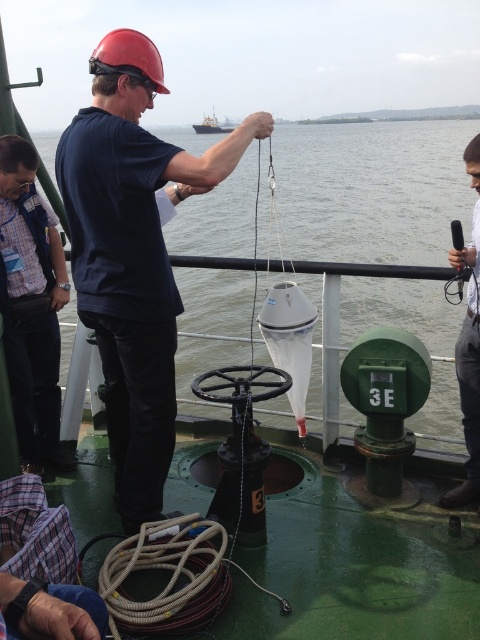
Who is lower down, matte black shirt at center or gray fabric shirt at right?

matte black shirt at center is below.

Can you confirm if matte black shirt at center is shorter than gray fabric shirt at right?

No.

Describe the element at coordinates (132, 253) in the screenshot. I see `matte black shirt at center` at that location.

The width and height of the screenshot is (480, 640). In order to click on matte black shirt at center in this screenshot , I will do `click(132, 253)`.

Is matte black shirt at center shorter than white plastic boat at upper center?

No.

Who is lower down, matte black shirt at center or white plastic boat at upper center?

matte black shirt at center

Measure the distance between point (195, 186) and camera.

Point (195, 186) and camera are 9.44 feet apart.

You are a GUI agent. You are given a task and a screenshot of the screen. Output one action in this format:
    pyautogui.click(x=<x>, y=<y>)
    Task: Click on the matte black shirt at center
    This screenshot has width=480, height=640.
    Given the screenshot: What is the action you would take?
    pyautogui.click(x=132, y=253)

Which is above, brushed metal shirt at left or gray fabric shirt at right?

gray fabric shirt at right is above.

Describe the element at coordinates (31, 307) in the screenshot. I see `brushed metal shirt at left` at that location.

Who is more distant from viewer, (49,451) or (474,269)?

The point (49,451) is more distant.

Where is `brushed metal shirt at left`? The width and height of the screenshot is (480, 640). brushed metal shirt at left is located at coordinates (31, 307).